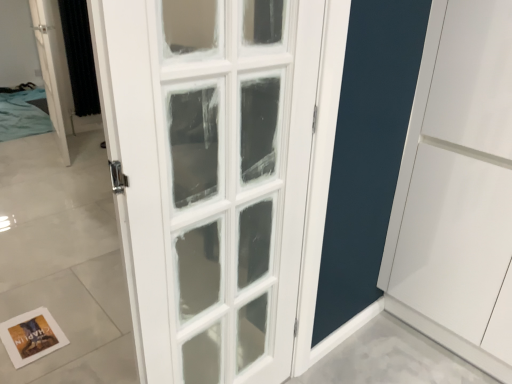
The width and height of the screenshot is (512, 384). Identify the location of white glass door at upper left. (54, 68).

Identify the location of white paper postcard at lower left. The height and width of the screenshot is (384, 512). click(x=31, y=336).

Between point (52, 322) and point (80, 82), which one is positioned in front?

Positioned in front is point (52, 322).

What's the angular difference between white paper postcard at lower left and black textured curtain at left's facing directions?

180 degrees separate the facing orientations of white paper postcard at lower left and black textured curtain at left.

Is white paper postcard at lower left looking in the opposite direction of black textured curtain at left?

No, white paper postcard at lower left is not facing away from black textured curtain at left.

Would you say black textured curtain at left is part of white paper postcard at lower left's contents?

No, black textured curtain at left is located outside of white paper postcard at lower left.

Between white paper postcard at lower left and white glass door at upper left, which one has more height?

white glass door at upper left.

Does white paper postcard at lower left have a larger size compared to white glass door at upper left?

Actually, white paper postcard at lower left might be smaller than white glass door at upper left.

How many degrees apart are the facing directions of white paper postcard at lower left and white glass door at upper left?

There is a 78.7-degree angle between the facing directions of white paper postcard at lower left and white glass door at upper left.

Would you say white paper postcard at lower left is a long distance from white glass door at upper left?

Absolutely, white paper postcard at lower left is distant from white glass door at upper left.

From the image's perspective, between white glass door at upper left and black textured curtain at left, which one is located above?

black textured curtain at left appears higher in the image.

Considering the sizes of objects white glass door at upper left and black textured curtain at left in the image provided, who is taller, white glass door at upper left or black textured curtain at left?

Standing taller between the two is white glass door at upper left.

Is white glass door at upper left thinner than black textured curtain at left?

Incorrect, the width of white glass door at upper left is not less than that of black textured curtain at left.

At what (x,y) coordinates should I click in order to perform the action: click on door lying on the left of black textured curtain at left. Please return your answer as a coordinate pair (x, y). The height and width of the screenshot is (384, 512). Looking at the image, I should click on (54, 68).

Is white glass door at upper left with white paper postcard at lower left?

No, white glass door at upper left is not in contact with white paper postcard at lower left.

Which is more to the left, white glass door at upper left or white paper postcard at lower left?

From the viewer's perspective, white glass door at upper left appears more on the left side.

Considering the sizes of white glass door at upper left and white paper postcard at lower left in the image, is white glass door at upper left bigger or smaller than white paper postcard at lower left?

In the image, white glass door at upper left appears to be larger than white paper postcard at lower left.

Can you tell me how much black textured curtain at left and white paper postcard at lower left differ in facing direction?

The angular difference between black textured curtain at left and white paper postcard at lower left is 180 degrees.

From a real-world perspective, is black textured curtain at left located beneath white paper postcard at lower left?

Incorrect, from a real-world perspective, black textured curtain at left is higher than white paper postcard at lower left.

Considering the sizes of objects black textured curtain at left and white paper postcard at lower left in the image provided, who is smaller, black textured curtain at left or white paper postcard at lower left?

With smaller size is white paper postcard at lower left.

Is point (88, 24) closer or farther from the camera than point (54, 343)?

Point (88, 24) is farther from the camera than point (54, 343).

The height and width of the screenshot is (384, 512). I want to click on door in front of the black textured curtain at left, so click(x=54, y=68).

Considering the sizes of objects black textured curtain at left and white glass door at upper left in the image provided, who is shorter, black textured curtain at left or white glass door at upper left?

With less height is black textured curtain at left.

Is black textured curtain at left turned away from white glass door at upper left?

black textured curtain at left does not have its back to white glass door at upper left.

In the image, is black textured curtain at left on the left side or the right side of white glass door at upper left?

In the image, black textured curtain at left appears on the right side of white glass door at upper left.

Find the location of a particular element. This screenshot has height=384, width=512. postcard on the right of black textured curtain at left is located at coordinates (31, 336).

The height and width of the screenshot is (384, 512). What are the coordinates of `door that appears behind the white paper postcard at lower left` in the screenshot? It's located at (54, 68).

Which object lies nearer to the anchor point white glass door at upper left, white paper postcard at lower left or black textured curtain at left?

black textured curtain at left lies closer to white glass door at upper left than the other object.

Looking at the image, which one is located closer to white paper postcard at lower left, black textured curtain at left or white glass door at upper left?

Based on the image, white glass door at upper left appears to be nearer to white paper postcard at lower left.

Which object lies nearer to the anchor point black textured curtain at left, white glass door at upper left or white paper postcard at lower left?

white glass door at upper left lies closer to black textured curtain at left than the other object.

From the image, which object appears to be nearer to black textured curtain at left, white paper postcard at lower left or white glass door at upper left?

Among the two, white glass door at upper left is located nearer to black textured curtain at left.

From the image, which object appears to be farther from white glass door at upper left, black textured curtain at left or white paper postcard at lower left?

white paper postcard at lower left is further to white glass door at upper left.

Which object lies further to the anchor point white paper postcard at lower left, white glass door at upper left or black textured curtain at left?

Based on the image, black textured curtain at left appears to be further to white paper postcard at lower left.

Locate an element on the screen. Image resolution: width=512 pixels, height=384 pixels. door that lies between black textured curtain at left and white paper postcard at lower left from top to bottom is located at coordinates (54, 68).